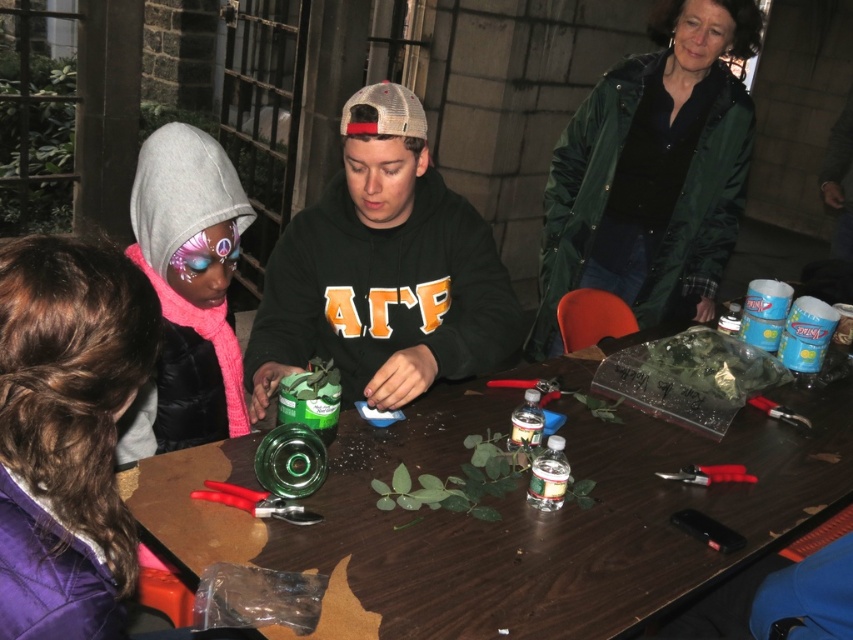
You are organizing a small workshop and need to place a new item on the table. Given that the brown wooden table at center is larger than the green matte sweatshirt at center, can you confirm if there is enough space on the table to accommodate an additional item?

The brown wooden table at center has a larger size compared to the green matte sweatshirt at center, which suggests there might be sufficient space to place an additional item on the table.

You are organizing a group photo and need to arrange two people wearing green matte sweatshirts. The scene shows a green matte sweatshirt at center and a green matte sweatshirt at upper right. Which sweatshirt is located to the left of the other?

The green matte sweatshirt at center is positioned on the left side of the green matte sweatshirt at upper right.

You are organizing a small event and need to place a decorative item on the brown wooden table at center. However, there is a green matte sweatshirt at upper right nearby. Which object should you place the decorative item on to ensure it is visible to all attendees?

The brown wooden table at center is larger in size than the green matte sweatshirt at upper right, so placing the decorative item on the brown wooden table at center would ensure better visibility as it has a larger surface area.